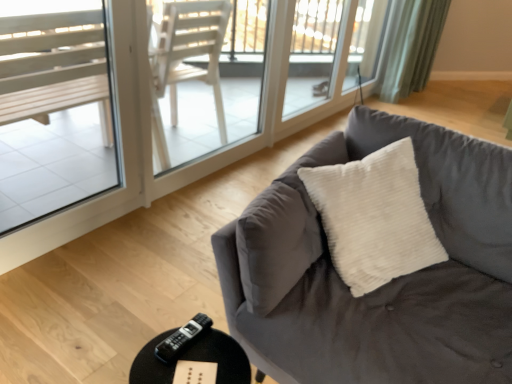
Question: Does transparent glass screen door at upper center, the 1th screen door positioned from the right, have a smaller size compared to transparent glass window at upper center, the first window when ordered from top to bottom?

Choices:
 (A) no
 (B) yes

Answer: (A)

Question: Does transparent glass screen door at upper center, the 1th screen door positioned from the right, have a greater height compared to transparent glass window at upper center, which is the 2th window in front-to-back order?

Choices:
 (A) no
 (B) yes

Answer: (B)

Question: Is transparent glass screen door at upper center, placed as the 2th screen door when sorted from front to back, turned away from transparent glass window at upper center, the first window when ordered from top to bottom?

Choices:
 (A) no
 (B) yes

Answer: (B)

Question: Can you confirm if transparent glass screen door at upper center, the 1th screen door positioned from the right, is positioned to the right of transparent glass window at upper center, the 1th window in the back-to-front sequence?

Choices:
 (A) yes
 (B) no

Answer: (B)

Question: Is transparent glass screen door at upper center, placed as the 2th screen door when sorted from front to back, positioned far away from transparent glass window at upper center, which is counted as the 2th window, starting from the bottom?

Choices:
 (A) no
 (B) yes

Answer: (A)

Question: In terms of size, does velvet gray couch at center appear bigger or smaller than black plastic remote at lower center?

Choices:
 (A) small
 (B) big

Answer: (B)

Question: Considering the positions of point (499, 190) and point (202, 326), is point (499, 190) closer or farther from the camera than point (202, 326)?

Choices:
 (A) closer
 (B) farther

Answer: (B)

Question: From the image's perspective, relative to black plastic remote at lower center, is velvet gray couch at center above or below?

Choices:
 (A) above
 (B) below

Answer: (A)

Question: In terms of height, does velvet gray couch at center look taller or shorter compared to black plastic remote at lower center?

Choices:
 (A) tall
 (B) short

Answer: (A)

Question: Is velvet gray couch at center in front of or behind green fabric curtain at upper right in the image?

Choices:
 (A) behind
 (B) front

Answer: (B)

Question: From their relative heights in the image, would you say velvet gray couch at center is taller or shorter than green fabric curtain at upper right?

Choices:
 (A) tall
 (B) short

Answer: (B)

Question: Considering the relative positions of velvet gray couch at center and green fabric curtain at upper right in the image provided, is velvet gray couch at center to the left or to the right of green fabric curtain at upper right?

Choices:
 (A) right
 (B) left

Answer: (B)

Question: Is velvet gray couch at center bigger or smaller than green fabric curtain at upper right?

Choices:
 (A) big
 (B) small

Answer: (A)

Question: In the image, is velvet gray couch at center positioned in front of or behind clear glass window at left, marked as the second window in a right-to-left arrangement?

Choices:
 (A) front
 (B) behind

Answer: (A)

Question: From a real-world perspective, relative to clear glass window at left, marked as the second window in a right-to-left arrangement, is velvet gray couch at center vertically above or below?

Choices:
 (A) below
 (B) above

Answer: (A)